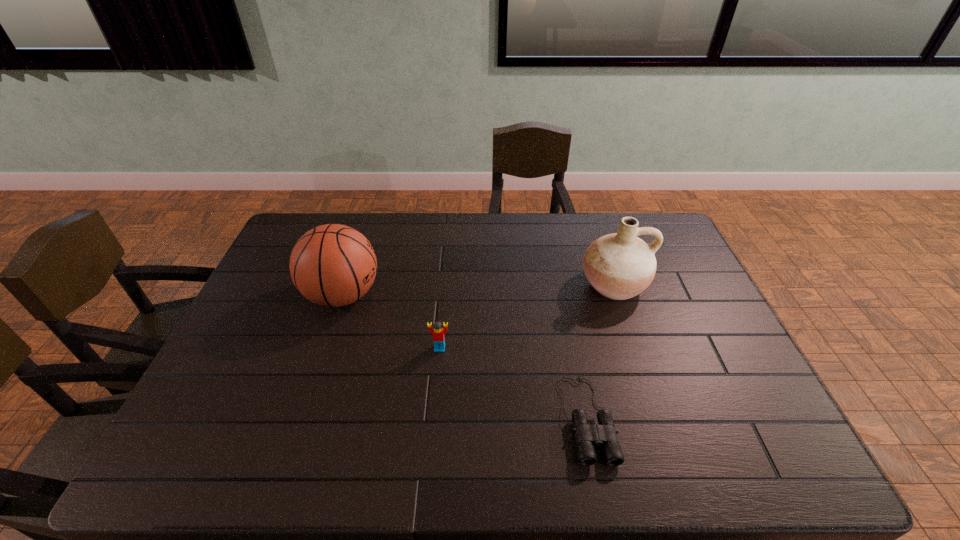
Identify the location of the rightmost object. The image size is (960, 540). (620, 265).

What are the coordinates of `basketball` in the screenshot? It's located at (333, 265).

Identify the location of the third farthest object. (438, 333).

Locate an element on the screen. the second shortest object is located at coordinates (438, 333).

The image size is (960, 540). In order to click on the shortest object in this screenshot , I will do pos(601,431).

Image resolution: width=960 pixels, height=540 pixels. I want to click on the second object from right to left, so pyautogui.click(x=601, y=431).

The width and height of the screenshot is (960, 540). What are the coordinates of `vacant space situated 0.350m to pour from the handle of the pottery` in the screenshot? It's located at (656, 412).

Find the location of a particular element. The image size is (960, 540). free region located on the surface of the leftmost object near the brand logo is located at coordinates (439, 295).

The height and width of the screenshot is (540, 960). I want to click on free space located 0.150m on the face of the third tallest object, so click(435, 400).

I want to click on object located at the near edge, so click(x=601, y=431).